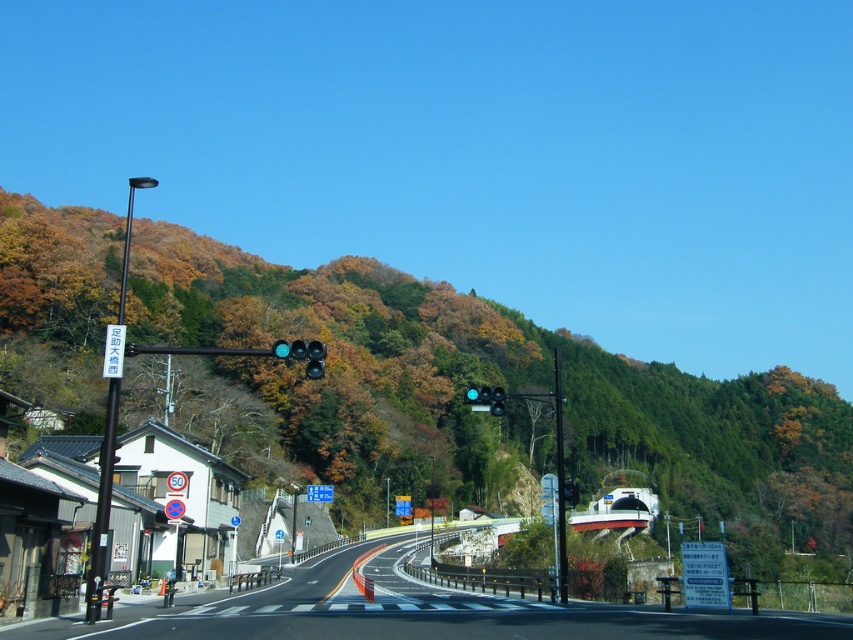
Who is shorter, green leafy hillside at upper center or matte black traffic light at upper center?

With less height is matte black traffic light at upper center.

Does green leafy hillside at upper center have a smaller size compared to matte black traffic light at upper center?

Incorrect, green leafy hillside at upper center is not smaller in size than matte black traffic light at upper center.

Which is in front, point (219, 419) or point (316, 372)?

Point (316, 372)

You are a GUI agent. You are given a task and a screenshot of the screen. Output one action in this format:
    pyautogui.click(x=<x>, y=<y>)
    Task: Click on the green leafy hillside at upper center
    
    Given the screenshot: What is the action you would take?
    pyautogui.click(x=479, y=384)

This screenshot has height=640, width=853. What do you see at coordinates (479, 384) in the screenshot?
I see `green leafy hillside at upper center` at bounding box center [479, 384].

Is green leafy hillside at upper center to the right of matte black traffic light at center from the viewer's perspective?

Yes, green leafy hillside at upper center is to the right of matte black traffic light at center.

You are a GUI agent. You are given a task and a screenshot of the screen. Output one action in this format:
    pyautogui.click(x=<x>, y=<y>)
    Task: Click on the green leafy hillside at upper center
    This screenshot has height=640, width=853.
    Given the screenshot: What is the action you would take?
    pyautogui.click(x=479, y=384)

Who is shorter, matte black traffic light at upper center or matte black traffic light at center?

Standing shorter between the two is matte black traffic light at upper center.

Does matte black traffic light at upper center appear on the left side of matte black traffic light at center?

Indeed, matte black traffic light at upper center is positioned on the left side of matte black traffic light at center.

Find the location of `matte black traffic light at upper center`. matte black traffic light at upper center is located at coordinates (302, 355).